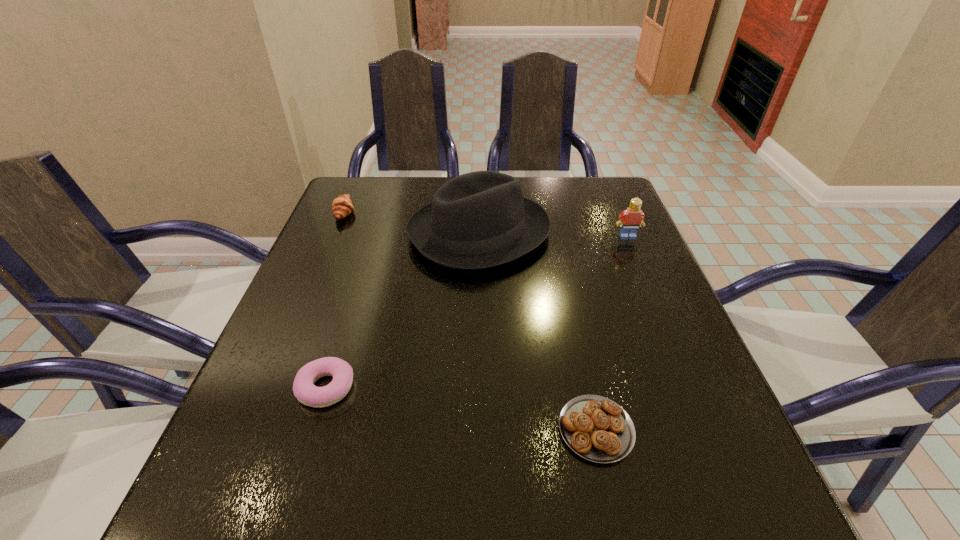
Identify the location of vacant space that satisfies the following two spatial constraints: 1. on the front side of the rightmost pastry; 2. on the right side of the second pastry from right to left. The height and width of the screenshot is (540, 960). (313, 429).